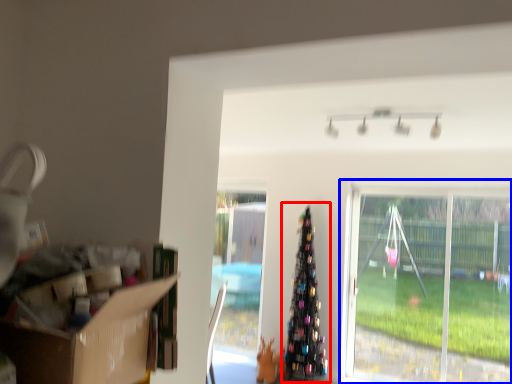
Question: Which object is closer to the camera taking this photo, christmas tree (highlighted by a red box) or window (highlighted by a blue box)?

Choices:
 (A) christmas tree
 (B) window

Answer: (B)